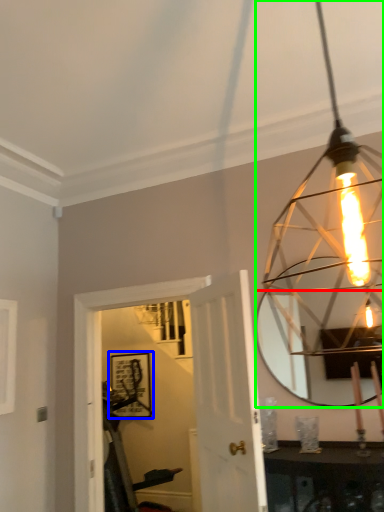
Question: Considering the real-world distances, which object is closest to mirror (highlighted by a red box)? picture frame (highlighted by a blue box) or lamp (highlighted by a green box).

Choices:
 (A) picture frame
 (B) lamp

Answer: (B)